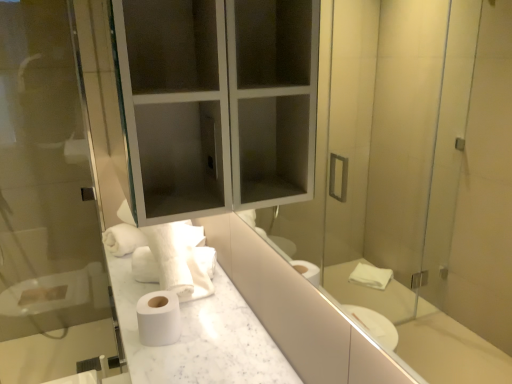
The width and height of the screenshot is (512, 384). Find the location of `empty space that is ontop of white marble countertop at center (from a real-world perspective)`. empty space that is ontop of white marble countertop at center (from a real-world perspective) is located at coordinates (181, 315).